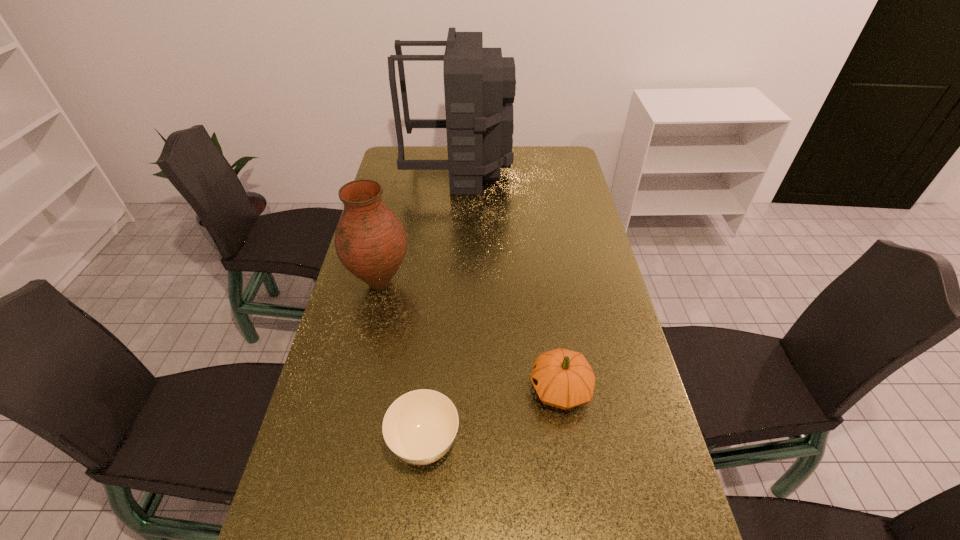
Select which object appears as the third closest to the third nearest object. Please provide its 2D coordinates. Your answer should be formatted as a tuple, i.e. [(x, y)], where the tuple contains the x and y coordinates of a point satisfying the conditions above.

[(562, 378)]

You are a GUI agent. You are given a task and a screenshot of the screen. Output one action in this format:
    pyautogui.click(x=<x>, y=<y>)
    Task: Click on the second closest object to the gourd
    This screenshot has height=540, width=960.
    Given the screenshot: What is the action you would take?
    pyautogui.click(x=370, y=241)